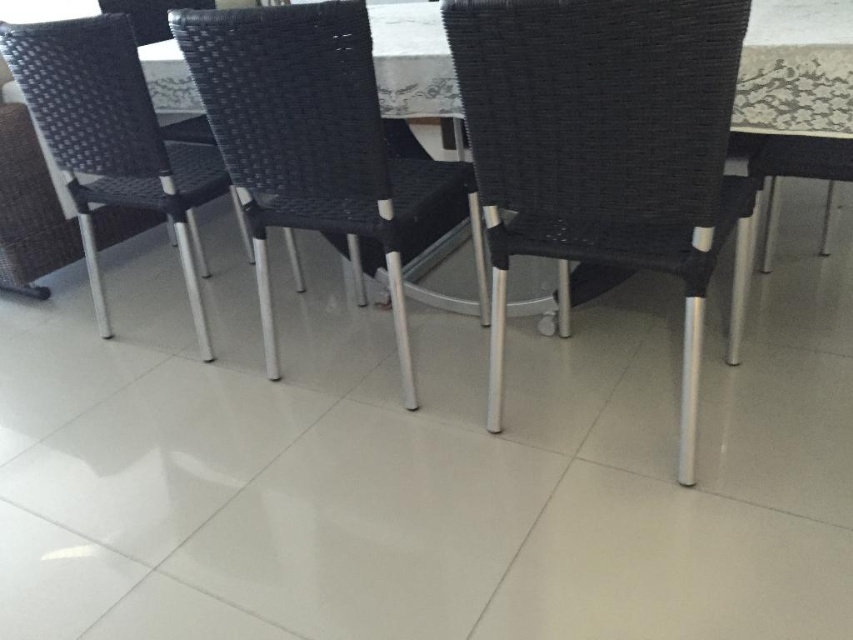
From the picture: You are a server arranging the dining area. You have two chairs, a woven black chair at center and a black woven chair at center. Which chair has a wider width?

The woven black chair at center is wider than the black woven chair at center according to the description.

You are standing in the dining area and want to reach both the point at coordinates point (503, 310) and point (831, 156). Which point should you reach first to minimize the distance walked?

You should reach point (503, 310) first because it is closer to you than point (831, 156).

You are a server in a restaurant and need to place a tray on the nearest chair to the table. Which chair should you choose between the matte black chair at center and the black woven chair at upper right?

The matte black chair at center is closer to the viewer than the black woven chair at upper right, so you should place the tray on the matte black chair at center as it is nearer to the table.